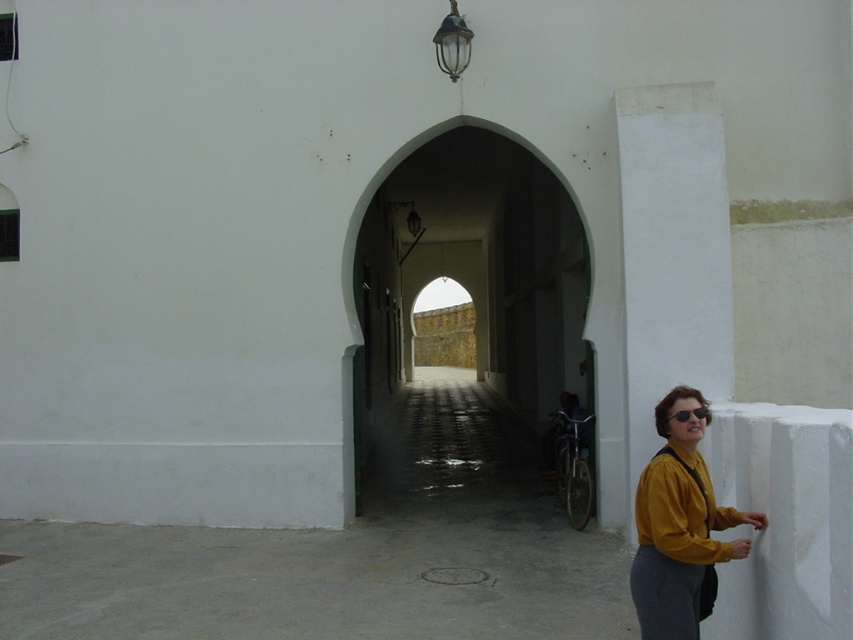
Measure the distance between white smooth pillar at right and matte yellow jacket at lower right.

A distance of 4.17 meters exists between white smooth pillar at right and matte yellow jacket at lower right.

Can you confirm if white smooth pillar at right is positioned below matte yellow jacket at lower right?

Incorrect, white smooth pillar at right is not positioned below matte yellow jacket at lower right.

Which is in front, point (679, 346) or point (647, 481)?

Point (647, 481) is in front.

What are the coordinates of `white smooth pillar at right` in the screenshot? It's located at (672, 252).

Is white stone archway at center bigger than matte yellow jacket at lower right?

Yes, white stone archway at center is bigger than matte yellow jacket at lower right.

Is point (534, 221) less distant than point (712, 557)?

No, it is not.

Identify the location of white stone archway at center. (471, 275).

Which is above, yellow matte shirt at lower right or matte yellow jacket at lower right?

yellow matte shirt at lower right is above.

Between yellow matte shirt at lower right and matte yellow jacket at lower right, which one is positioned lower?

matte yellow jacket at lower right is below.

Is point (672, 392) positioned after point (662, 497)?

Yes, point (672, 392) is farther from viewer.

The image size is (853, 640). I want to click on yellow matte shirt at lower right, so click(x=677, y=525).